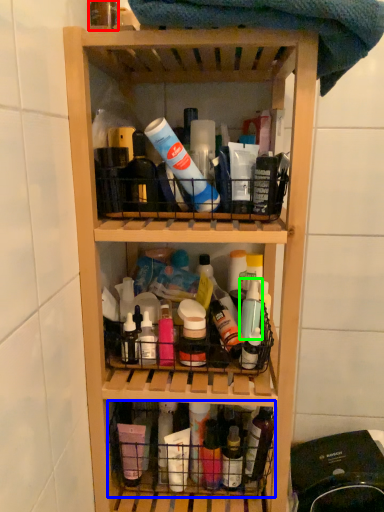
Question: Considering the real-world distances, which object is closest to bottle (highlighted by a red box)? basket (highlighted by a blue box) or bottle (highlighted by a green box).

Choices:
 (A) basket
 (B) bottle

Answer: (B)